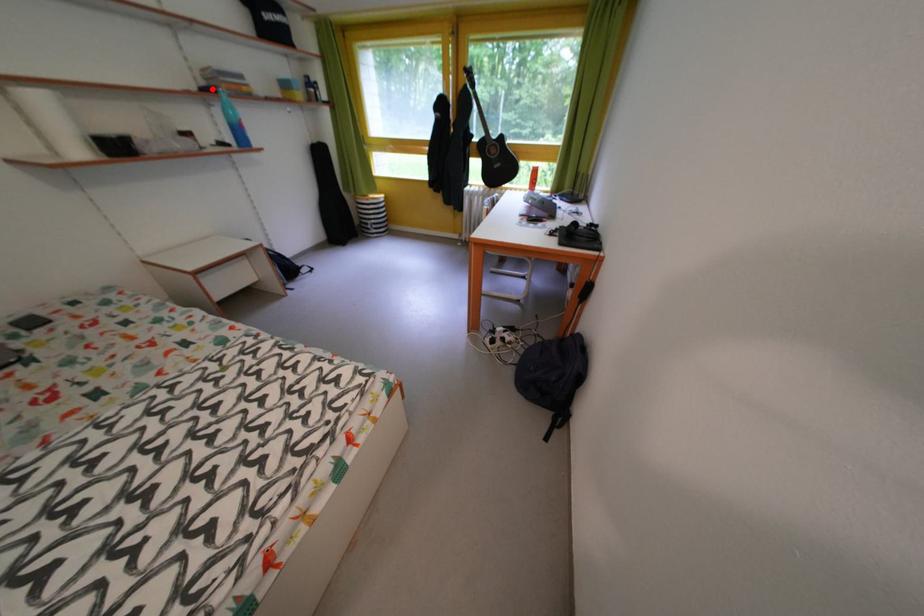
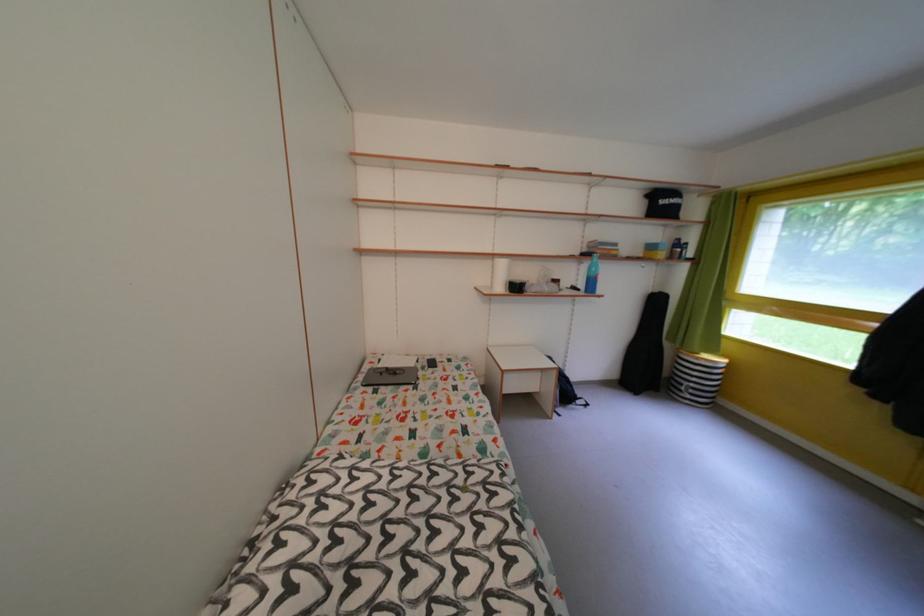
The point at the highlighted location is marked in the first image. Where is the corresponding point in the second image?

(594, 256)